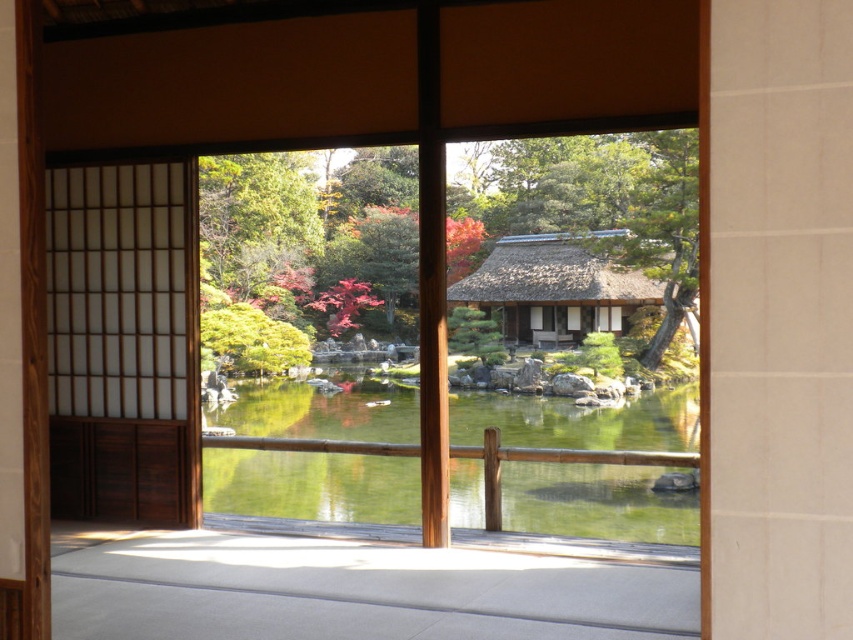
Question: Which point is closer to the camera?

Choices:
 (A) (137, 202)
 (B) (248, 410)

Answer: (A)

Question: Can you confirm if green reflective water at center is smaller than wooden shoji screen at left?

Choices:
 (A) no
 (B) yes

Answer: (A)

Question: Is green reflective water at center smaller than wooden shoji screen at left?

Choices:
 (A) no
 (B) yes

Answer: (A)

Question: Is green reflective water at center positioned at the back of wooden shoji screen at left?

Choices:
 (A) no
 (B) yes

Answer: (A)